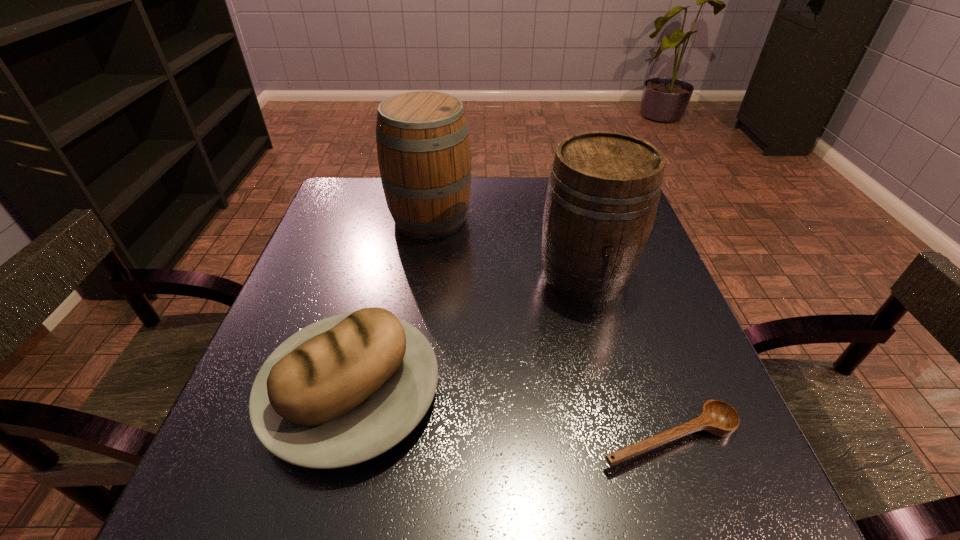
At what (x,y) coordinates should I click in order to perform the action: click on object situated at the far edge. Please return your answer as a coordinate pair (x, y). The image size is (960, 540). Looking at the image, I should click on (423, 149).

Image resolution: width=960 pixels, height=540 pixels. In order to click on bread that is at the near edge in this screenshot , I will do `click(345, 389)`.

The image size is (960, 540). In order to click on wooden spoon that is at the near edge in this screenshot , I will do `click(717, 417)`.

In order to click on object at the left edge in this screenshot , I will do `click(345, 389)`.

The width and height of the screenshot is (960, 540). I want to click on cider that is positioned at the right edge, so click(603, 191).

The height and width of the screenshot is (540, 960). Find the location of `wooden spoon at the right edge`. wooden spoon at the right edge is located at coordinates (717, 417).

Locate an element on the screen. object located at the near left corner is located at coordinates (345, 389).

Image resolution: width=960 pixels, height=540 pixels. In order to click on object present at the near right corner in this screenshot , I will do (717, 417).

The height and width of the screenshot is (540, 960). I want to click on vacant region at the far edge, so click(x=471, y=194).

Identify the location of vacant space at the near edge of the desktop. (345, 488).